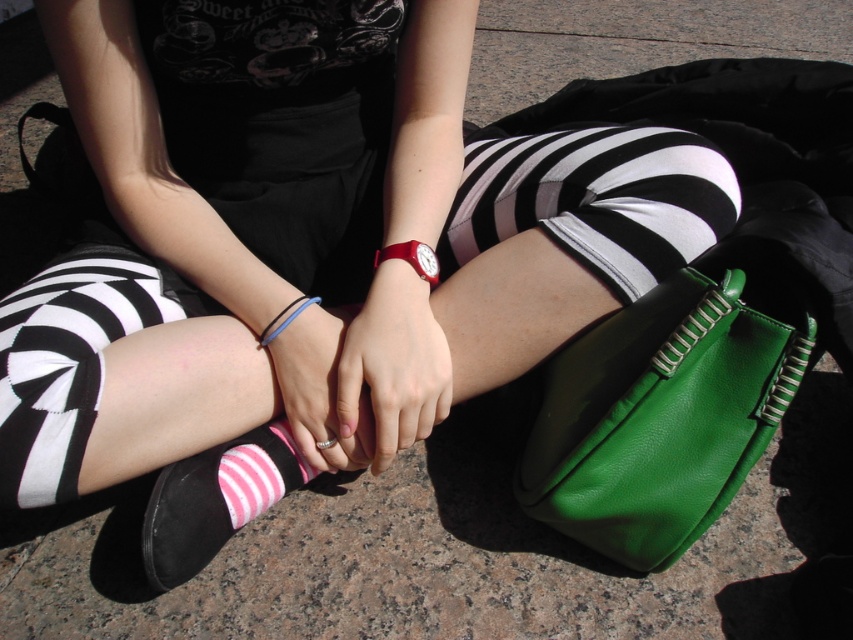
What do you see at coordinates (659, 417) in the screenshot? The width and height of the screenshot is (853, 640). I see `green leather handbag at lower right` at bounding box center [659, 417].

Is green leather handbag at lower right to the right of rubber band at center from the viewer's perspective?

Yes, green leather handbag at lower right is to the right of rubber band at center.

The width and height of the screenshot is (853, 640). In order to click on green leather handbag at lower right in this screenshot , I will do `click(659, 417)`.

Is green leather handbag at lower right closer to camera compared to pink striped sock at lower center?

Yes, it is.

Is green leather handbag at lower right bigger than pink striped sock at lower center?

Correct, green leather handbag at lower right is larger in size than pink striped sock at lower center.

Between point (547, 444) and point (254, 449), which one is positioned behind?

Point (254, 449)

Locate an element on the screen. Image resolution: width=853 pixels, height=640 pixels. green leather handbag at lower right is located at coordinates (659, 417).

Is point (403, 253) closer to viewer compared to point (300, 307)?

No, (403, 253) is further to viewer.

Can you confirm if rubber band at center is positioned to the left of black rubber bracelet at center?

Incorrect, rubber band at center is not on the left side of black rubber bracelet at center.

What do you see at coordinates (412, 259) in the screenshot? I see `rubber band at center` at bounding box center [412, 259].

Find the location of a particular element. The width and height of the screenshot is (853, 640). rubber band at center is located at coordinates (412, 259).